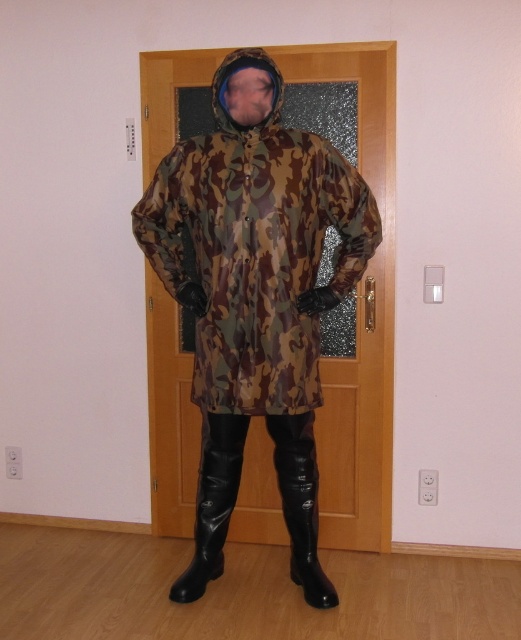
Question: Which is nearer to the black patent leather boot at lower center?

Choices:
 (A) black leather boot at lower center
 (B) camouflage fabric jacket at center

Answer: (A)

Question: Which point is closer to the camera?

Choices:
 (A) (205, 264)
 (B) (205, 570)

Answer: (A)

Question: Does black leather boot at lower center have a greater width compared to black patent leather boot at lower center?

Choices:
 (A) yes
 (B) no

Answer: (A)

Question: From the image, what is the correct spatial relationship of black leather boot at lower center in relation to camo fabric hood at center?

Choices:
 (A) above
 (B) below

Answer: (B)

Question: Is black leather boot at lower center closer to the viewer compared to camo fabric hood at center?

Choices:
 (A) yes
 (B) no

Answer: (B)

Question: Among these points, which one is farthest from the camera?

Choices:
 (A) (232, 483)
 (B) (279, 456)
 (C) (170, 273)

Answer: (A)